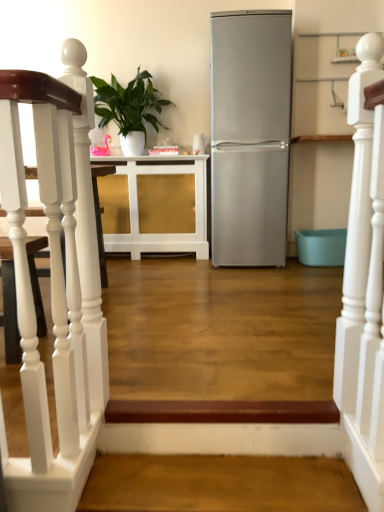
At what (x,y) coordinates should I click in order to perform the action: click on vacant space positioned to the left of satin silver refrigerator at center. Please return your answer as a coordinate pair (x, y). Looking at the image, I should click on (179, 265).